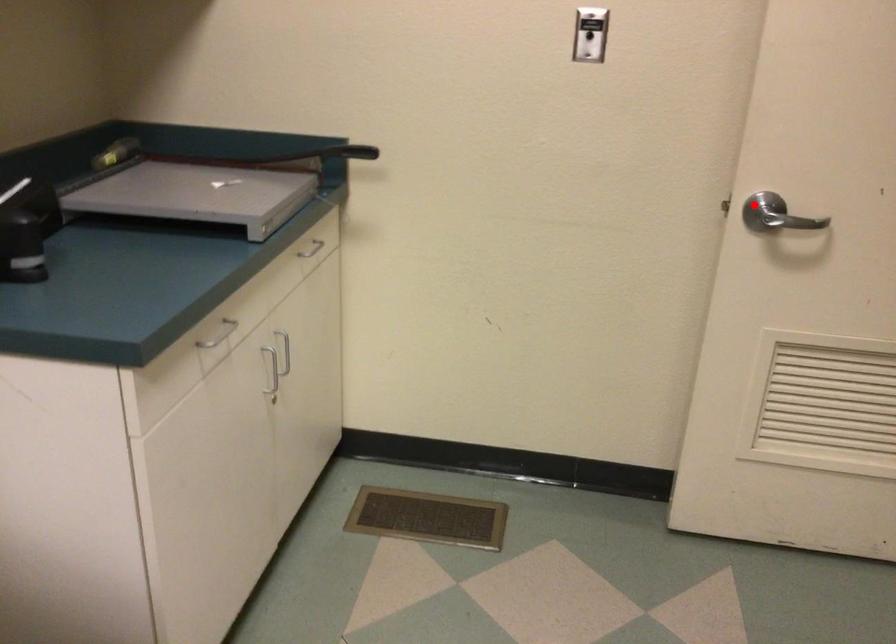
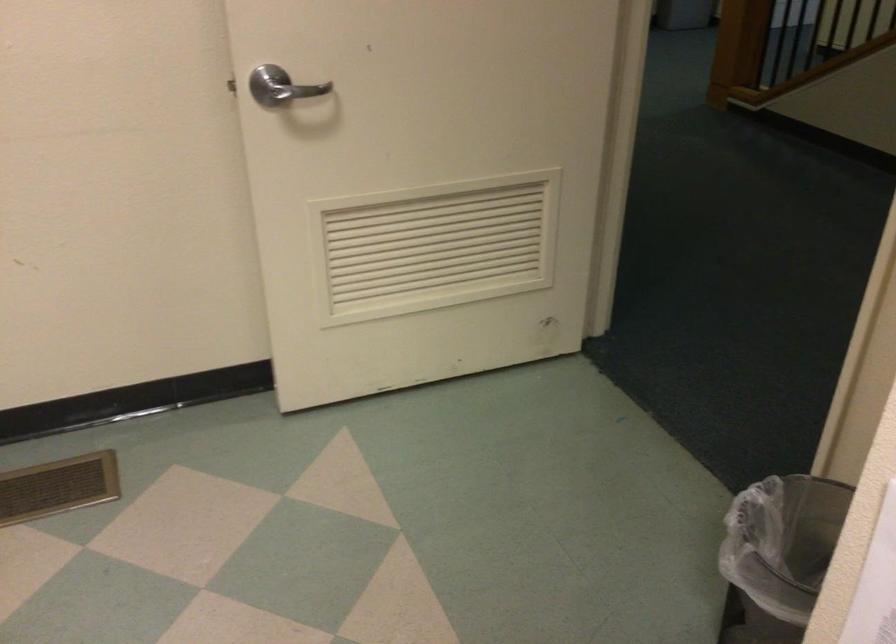
Where in the second image is the point corresponding to the highlighted location from the first image?

(270, 86)